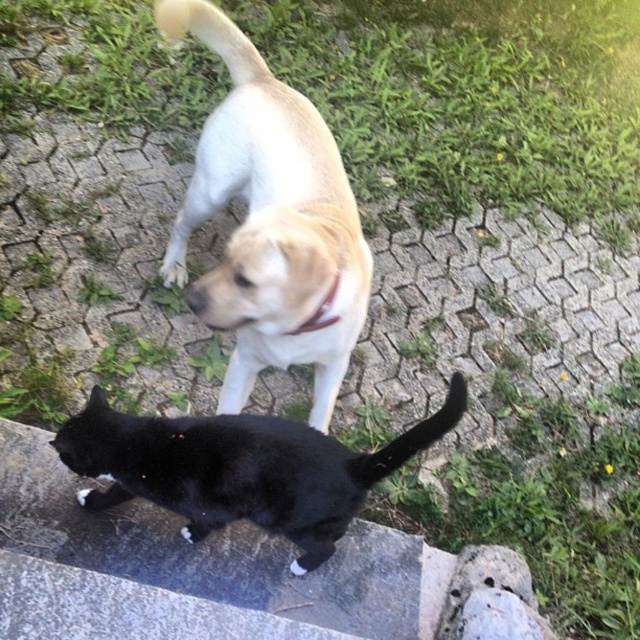
Does black matte fur cat at lower left have a larger size compared to black matte tail at lower center?

Yes, black matte fur cat at lower left is bigger than black matte tail at lower center.

Is black matte fur cat at lower left to the right of black matte tail at lower center from the viewer's perspective?

In fact, black matte fur cat at lower left is to the left of black matte tail at lower center.

I want to click on black matte fur cat at lower left, so click(240, 468).

Identify the location of black matte fur cat at lower left. (240, 468).

Is point (294, 104) positioned in front of point (413, 442)?

No, (294, 104) is further to viewer.

Which is behind, point (168, 266) or point (374, 460)?

Point (168, 266)

Between point (236, 188) and point (360, 465), which one is positioned behind?

The point (236, 188) is behind.

You are a GUI agent. You are given a task and a screenshot of the screen. Output one action in this format:
    pyautogui.click(x=<x>, y=<y>)
    Task: Click on the light brown fur dog at center
    This screenshot has height=640, width=640.
    Given the screenshot: What is the action you would take?
    pyautogui.click(x=269, y=224)

Is light brown fur dog at center to the right of black matte fur cat at lower left from the viewer's perspective?

Incorrect, light brown fur dog at center is not on the right side of black matte fur cat at lower left.

Does point (198, 147) come in front of point (280, 458)?

No.

Does point (195, 26) lie in front of point (304, 444)?

No, (195, 26) is further to viewer.

What are the coordinates of `light brown fur dog at center` in the screenshot? It's located at (269, 224).